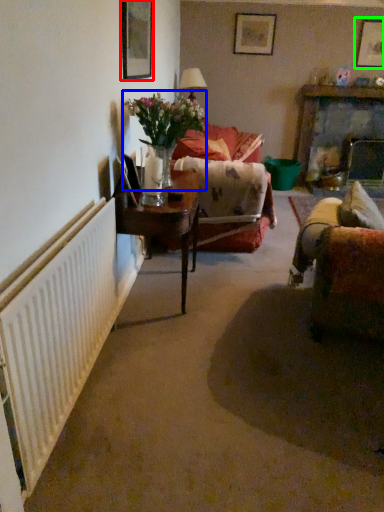
Question: Estimate the real-world distances between objects in this image. Which object is farther from picture frame (highlighted by a red box), floral arrangement (highlighted by a blue box) or picture frame (highlighted by a green box)?

Choices:
 (A) floral arrangement
 (B) picture frame

Answer: (B)